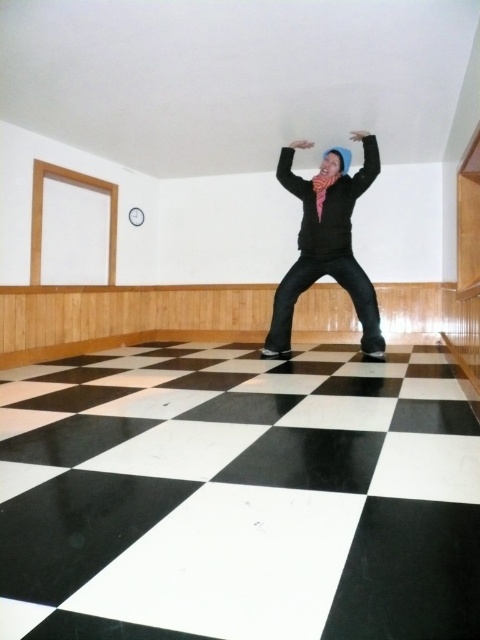
Looking at this image, you are a fashion designer analyzing the placement of the matte black hoodie at center in the image. Considering the room layout described, can you determine if the hoodie is closer to the wooden paneling on the walls or the white wall area?

The matte black hoodie at center is located at point (x=326, y=241), which places it closer to the wooden paneling on the walls since the paneling is along the lower portion of the walls and the hoodie is positioned centrally in the room.

Consider the image. You are a photographer trying to capture the person in the image. You want to focus on the matte black hoodie at center and the black matte arm at upper center. Which object should you adjust your camera focus on first if you want to ensure both are in focus?

The matte black hoodie at center is closer to you than the black matte arm at upper center. To ensure both are in focus, you should focus on the matte black hoodie at center first, as it is closer, and the black matte arm at upper center will fall into the depth of field behind it.